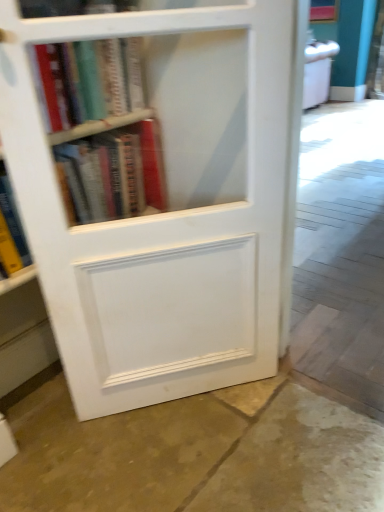
Question: Is hardcover books at upper left, which is the 1th book from bottom to top, not near white matte bookcase at center?

Choices:
 (A) no
 (B) yes

Answer: (A)

Question: Considering the relative sizes of hardcover books at upper left, placed as the 2th book when sorted from top to bottom, and white matte bookcase at center in the image provided, is hardcover books at upper left, placed as the 2th book when sorted from top to bottom, bigger than white matte bookcase at center?

Choices:
 (A) yes
 (B) no

Answer: (B)

Question: From a real-world perspective, is hardcover books at upper left, placed as the 2th book when sorted from top to bottom, physically above white matte bookcase at center?

Choices:
 (A) no
 (B) yes

Answer: (B)

Question: Does hardcover books at upper left, which is the 1th book from bottom to top, lie behind white matte bookcase at center?

Choices:
 (A) yes
 (B) no

Answer: (A)

Question: From the image's perspective, is hardcover books at upper left, placed as the 2th book when sorted from top to bottom, above white matte bookcase at center?

Choices:
 (A) yes
 (B) no

Answer: (A)

Question: Can you confirm if hardcover books at upper left, placed as the 2th book when sorted from top to bottom, is taller than white matte bookcase at center?

Choices:
 (A) no
 (B) yes

Answer: (A)

Question: Can you confirm if hardcover books at upper left, which is the 1th book from bottom to top, is positioned to the right of hardcover book at upper left, acting as the 1th book starting from the top?

Choices:
 (A) no
 (B) yes

Answer: (B)

Question: Would you say hardcover books at upper left, placed as the 2th book when sorted from top to bottom, contains hardcover book at upper left, acting as the 1th book starting from the top?

Choices:
 (A) yes
 (B) no

Answer: (B)

Question: Is hardcover books at upper left, placed as the 2th book when sorted from top to bottom, facing away from hardcover book at upper left, acting as the 1th book starting from the top?

Choices:
 (A) yes
 (B) no

Answer: (B)

Question: From the image's perspective, is hardcover books at upper left, placed as the 2th book when sorted from top to bottom, below hardcover book at upper left, acting as the 1th book starting from the top?

Choices:
 (A) no
 (B) yes

Answer: (B)

Question: From a real-world perspective, is hardcover books at upper left, placed as the 2th book when sorted from top to bottom, positioned over hardcover book at upper left, acting as the 1th book starting from the top, based on gravity?

Choices:
 (A) no
 (B) yes

Answer: (A)

Question: Is hardcover books at upper left, which is the 1th book from bottom to top, smaller than hardcover book at upper left, acting as the 1th book starting from the top?

Choices:
 (A) yes
 (B) no

Answer: (B)

Question: Considering the relative positions of brown stone floor at lower center and white matte bookcase at center in the image provided, is brown stone floor at lower center to the right of white matte bookcase at center from the viewer's perspective?

Choices:
 (A) yes
 (B) no

Answer: (B)